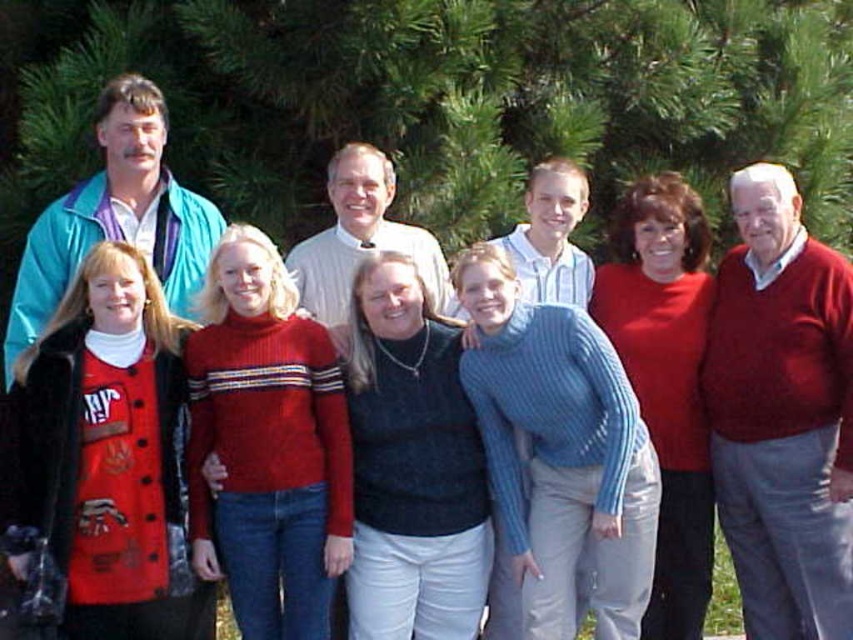
How far apart are green leafy pine at upper center and red sweater at right?

green leafy pine at upper center is 2.18 meters from red sweater at right.

Who is positioned more to the left, green leafy pine at upper center or red sweater at right?

green leafy pine at upper center is more to the left.

Does point (444, 76) lie behind point (782, 291)?

Yes, it is.

Locate an element on the screen. The width and height of the screenshot is (853, 640). green leafy pine at upper center is located at coordinates (456, 99).